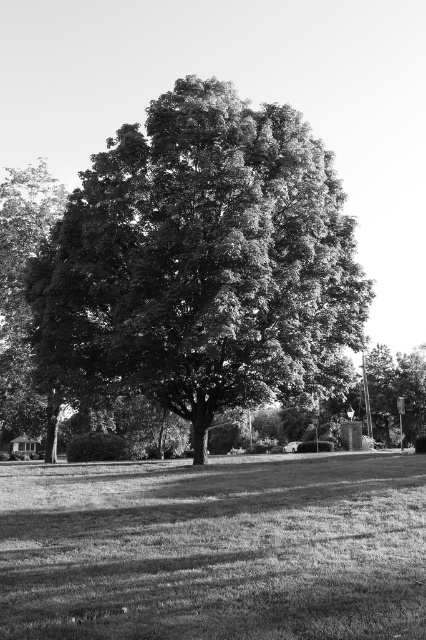
You are standing in the middle of the grassy lawn at center and want to walk towards the dark green leafy oak tree at center. In which direction should you head?

You should head to the right because the dark green leafy oak tree at center is to the right of the grassy lawn at center.

You are standing in the middle of the image and want to walk towards the edge. Which direction should you go to avoid the dark green leafy oak tree at center and the grassy lawn at center?

Since the dark green leafy oak tree at center is bigger than the grassy lawn at center, you should walk towards the edge opposite the tree to avoid both objects.

Based on the photo, you are standing in the middle of the image and want to walk towards the grassy lawn at center. Which direction should you move relative to the dark green leafy oak tree at center?

The grassy lawn at center is behind the dark green leafy oak tree at center, so you should move away from the tree to reach it.